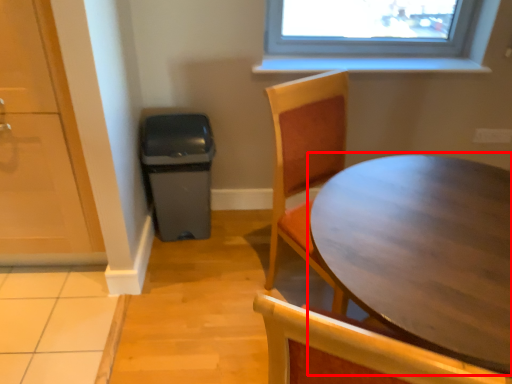
Question: From the image's perspective, where is table (annotated by the red box) located relative to screen door?

Choices:
 (A) below
 (B) above

Answer: (A)